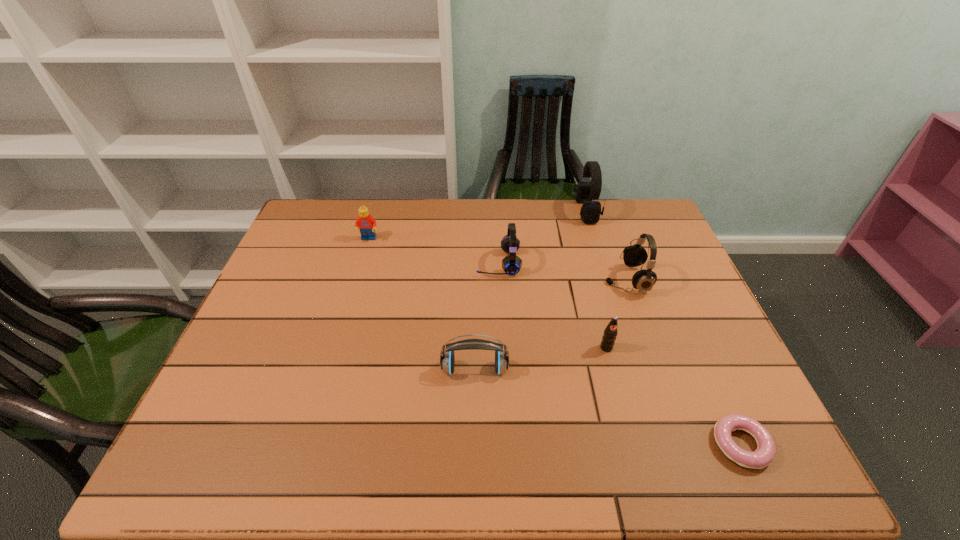
What are the coordinates of `vacant point located between the doughnut and the third nearest object` in the screenshot? It's located at (674, 396).

At what (x,y) coordinates should I click in order to perform the action: click on vacant space that is in between the nearest object and the third nearest object. Please return your answer as a coordinate pair (x, y). Looking at the image, I should click on (674, 396).

Locate an element on the screen. This screenshot has width=960, height=540. empty space between the sixth nearest object and the nearest headset is located at coordinates (421, 304).

Identify the location of free space between the nearest object and the fifth farthest object. The image size is (960, 540). (674, 396).

Point out which object is positioned as the sixth nearest to the Lego. Please provide its 2D coordinates. Your answer should be formatted as a tuple, i.e. [(x, y)], where the tuple contains the x and y coordinates of a point satisfying the conditions above.

[(764, 455)]

Point out which object is positioned as the second nearest to the farthest headset. Please provide its 2D coordinates. Your answer should be formatted as a tuple, i.e. [(x, y)], where the tuple contains the x and y coordinates of a point satisfying the conditions above.

[(511, 264)]

You are a GUI agent. You are given a task and a screenshot of the screen. Output one action in this format:
    pyautogui.click(x=<x>, y=<y>)
    Task: Click on the headset that is the third closest one to the tallest object
    This screenshot has height=540, width=960.
    Given the screenshot: What is the action you would take?
    pyautogui.click(x=447, y=361)

Image resolution: width=960 pixels, height=540 pixels. Find the location of `headset object that ranks as the second closest to the sixth farthest object`. headset object that ranks as the second closest to the sixth farthest object is located at coordinates (643, 280).

You are a GUI agent. You are given a task and a screenshot of the screen. Output one action in this format:
    pyautogui.click(x=<x>, y=<y>)
    Task: Click on the vacant space that satisfies the following two spatial constraints: 1. on the headband of the nearest object; 2. on the left side of the tallest headset
    Image resolution: width=960 pixels, height=540 pixels.
    Given the screenshot: What is the action you would take?
    pyautogui.click(x=658, y=445)

Locate an element on the screen. This screenshot has width=960, height=540. vacant area that satisfies the following two spatial constraints: 1. on the face of the sixth nearest object; 2. on the left side of the doughnut is located at coordinates (307, 445).